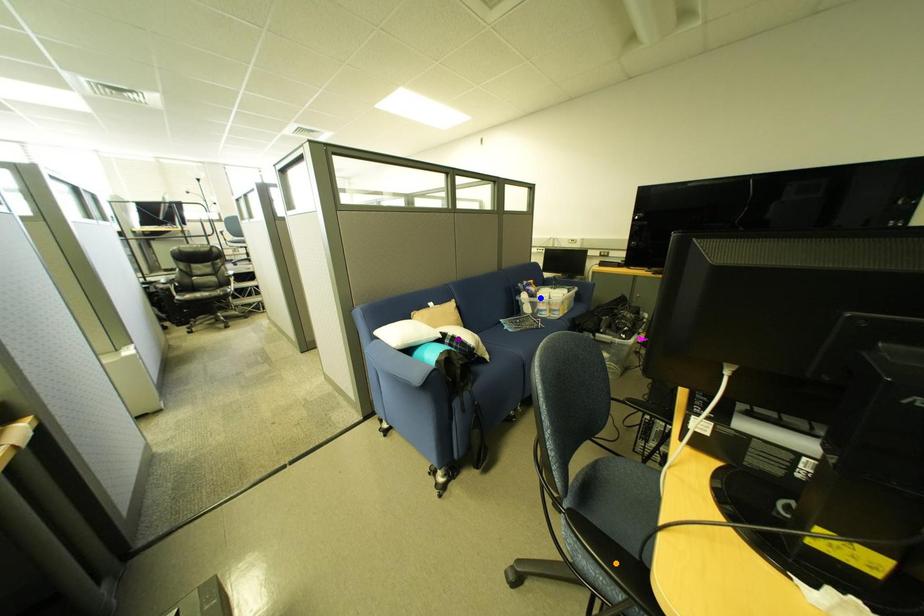
Order these from farthest to nearest:
orange point
purple point
blue point

blue point < purple point < orange point